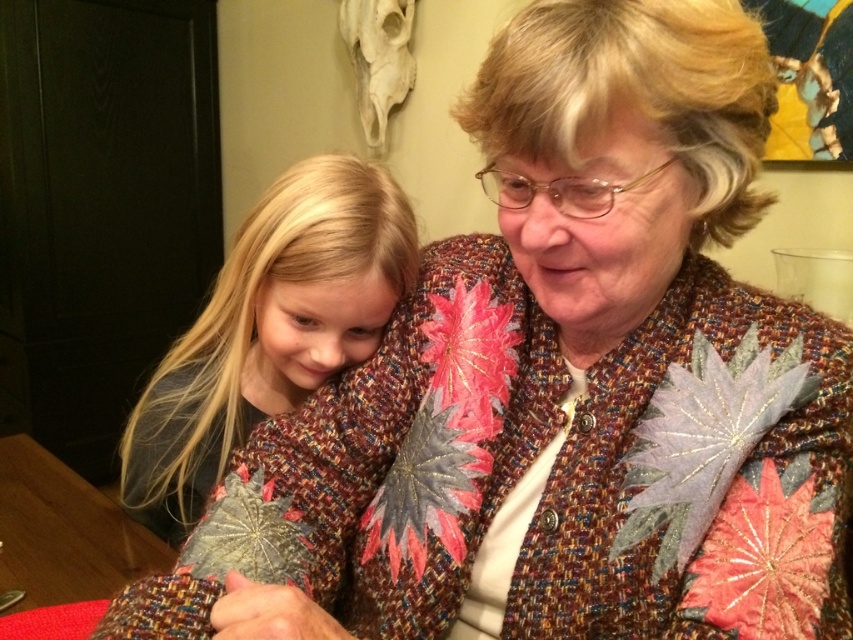
Looking at this image, is blonde hair at left closer to the viewer compared to wooden table at lower left?

Yes, it is in front of wooden table at lower left.

Is blonde hair at left thinner than wooden table at lower left?

Yes, blonde hair at left is thinner than wooden table at lower left.

Is point (250, 214) positioned after point (112, 557)?

No, it is not.

At what (x,y) coordinates should I click in order to perform the action: click on blonde hair at left. Please return your answer as a coordinate pair (x, y). Looking at the image, I should click on pos(268,330).